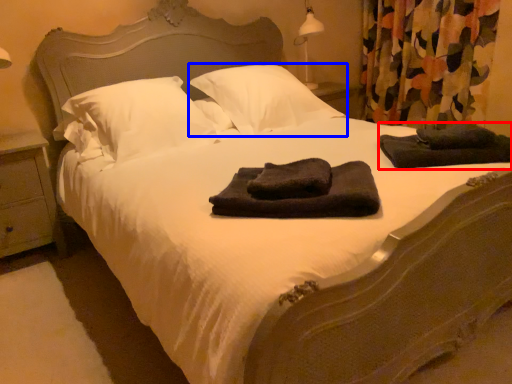
Question: Among these objects, which one is farthest to the camera, material (highlighted by a red box) or pillow (highlighted by a blue box)?

Choices:
 (A) material
 (B) pillow

Answer: (B)